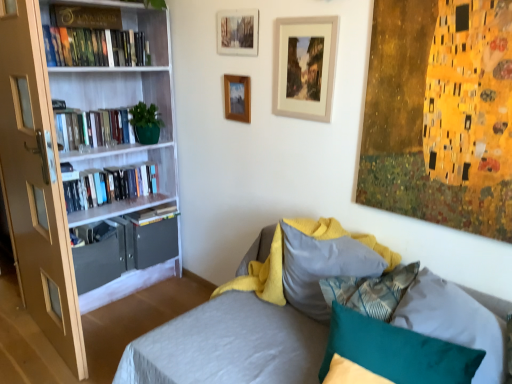
You are a GUI agent. You are given a task and a screenshot of the screen. Output one action in this format:
    pyautogui.click(x=<x>, y=<y>)
    Task: Click on the vacant space situated above hardcover books at left, the third book positioned from the top (from a real-world perspective)
    This screenshot has height=384, width=512.
    Given the screenshot: What is the action you would take?
    pyautogui.click(x=100, y=110)